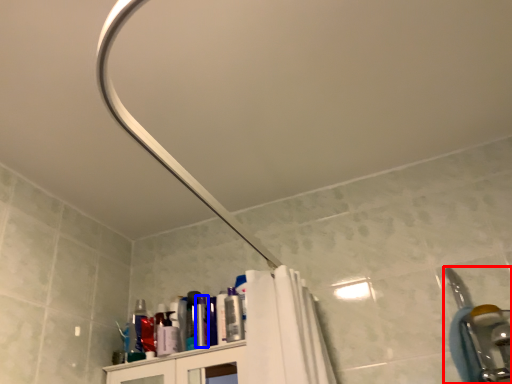
Question: Among these objects, which one is farthest to the camera, plumbing fixture (highlighted by a red box) or toiletry (highlighted by a blue box)?

Choices:
 (A) plumbing fixture
 (B) toiletry

Answer: (B)